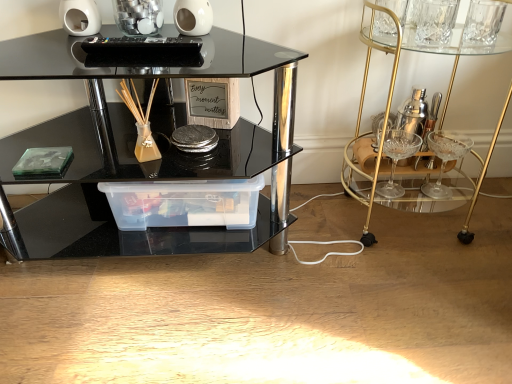
At what (x,y) coordinates should I click in order to perform the action: click on gold glass bar cart at right. Please return your answer as a coordinate pair (x, y). Looking at the image, I should click on (436, 131).

Describe the element at coordinates (436, 131) in the screenshot. I see `gold glass bar cart at right` at that location.

The width and height of the screenshot is (512, 384). In order to click on transparent plastic container at center in this screenshot , I will do `click(184, 203)`.

The width and height of the screenshot is (512, 384). Find the location of `black glass table at center`. black glass table at center is located at coordinates (155, 167).

Is point (249, 195) closer or farther from the camera than point (51, 179)?

Point (249, 195).

How many degrees apart are the facing directions of transparent plastic container at center and black glass table at center?

transparent plastic container at center and black glass table at center are facing 3.82 degrees away from each other.

Is transparent plastic container at center positioned beyond the bounds of black glass table at center?

No, most part of transparent plastic container at center lies within black glass table at center.

Considering the positions of objects transparent plastic container at center and black glass table at center in the image provided, who is behind, transparent plastic container at center or black glass table at center?

transparent plastic container at center is more distant.

Which is closer, (164, 203) or (467, 195)?

The point (164, 203) is in front.

From the image's perspective, does transparent plastic container at center appear lower than gold glass bar cart at right?

Yes, from the image's perspective, transparent plastic container at center is beneath gold glass bar cart at right.

Is transparent plastic container at center positioned with its back to gold glass bar cart at right?

No.

Would you consider transparent plastic container at center to be distant from gold glass bar cart at right?

transparent plastic container at center is near gold glass bar cart at right, not far away.

Is black glass table at center bigger than transparent plastic container at center?

Correct, black glass table at center is larger in size than transparent plastic container at center.

Is black glass table at center inside or outside of transparent plastic container at center?

black glass table at center exists outside the volume of transparent plastic container at center.

Is black glass table at center taller than transparent plastic container at center?

Correct, black glass table at center is much taller as transparent plastic container at center.

Between black glass table at center and transparent plastic container at center, which one has smaller width?

transparent plastic container at center is thinner.

Consider the image. In terms of width, does gold glass bar cart at right look wider or thinner when compared to transparent plastic container at center?

Considering their sizes, gold glass bar cart at right looks broader than transparent plastic container at center.

Is the position of gold glass bar cart at right less distant than that of transparent plastic container at center?

Yes, it is.

Which is closer to the camera, (399, 204) or (163, 212)?

The point (163, 212) is more forward.

Is gold glass bar cart at right oriented towards transparent plastic container at center?

No, gold glass bar cart at right is not turned towards transparent plastic container at center.

Which is correct: black glass table at center is inside gold glass bar cart at right, or outside of it?

black glass table at center cannot be found inside gold glass bar cart at right.

From the image's perspective, would you say black glass table at center is shown under gold glass bar cart at right?

Yes, from the image's perspective, black glass table at center is below gold glass bar cart at right.

Looking at their sizes, would you say black glass table at center is wider or thinner than gold glass bar cart at right?

Considering their sizes, black glass table at center looks broader than gold glass bar cart at right.

Which is behind, black glass table at center or gold glass bar cart at right?

gold glass bar cart at right is further from the camera.

Which is correct: gold glass bar cart at right is inside black glass table at center, or outside of it?

gold glass bar cart at right is located beyond the bounds of black glass table at center.

Is gold glass bar cart at right smaller than black glass table at center?

Yes.

Is gold glass bar cart at right positioned with its back to black glass table at center?

gold glass bar cart at right is not turned away from black glass table at center.

At what (x,y) coordinates should I click in order to perform the action: click on glass box located below the black glass table at center (from the image's perspective). Please return your answer as a coordinate pair (x, y). Looking at the image, I should click on (184, 203).

The width and height of the screenshot is (512, 384). I want to click on vanity above the transparent plastic container at center (from the image's perspective), so click(436, 131).

From the image, which object appears to be nearer to gold glass bar cart at right, transparent plastic container at center or black glass table at center?

Among the two, transparent plastic container at center is located nearer to gold glass bar cart at right.

Considering their positions, is gold glass bar cart at right positioned further to transparent plastic container at center than black glass table at center?

Based on the image, gold glass bar cart at right appears to be further to transparent plastic container at center.

In the scene shown: Looking at the image, which one is located further to black glass table at center, gold glass bar cart at right or transparent plastic container at center?

gold glass bar cart at right is further to black glass table at center.

Consider the image. Looking at the image, which one is located further to gold glass bar cart at right, black glass table at center or transparent plastic container at center?

black glass table at center lies further to gold glass bar cart at right than the other object.

When comparing their distances from black glass table at center, does transparent plastic container at center or gold glass bar cart at right seem further?

The object further to black glass table at center is gold glass bar cart at right.

Which object lies further to the anchor point transparent plastic container at center, black glass table at center or gold glass bar cart at right?

The object further to transparent plastic container at center is gold glass bar cart at right.

Locate an element on the screen. This screenshot has width=512, height=384. glass box between black glass table at center and gold glass bar cart at right from left to right is located at coordinates (184, 203).